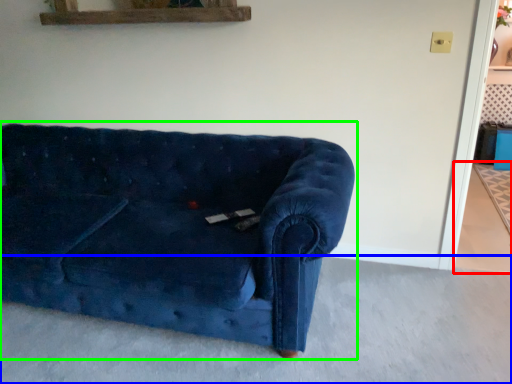
Question: Which object is positioned closest to concrete (highlighted by a red box)? Select from concrete (highlighted by a blue box) and studio couch (highlighted by a green box).

Choices:
 (A) concrete
 (B) studio couch

Answer: (A)